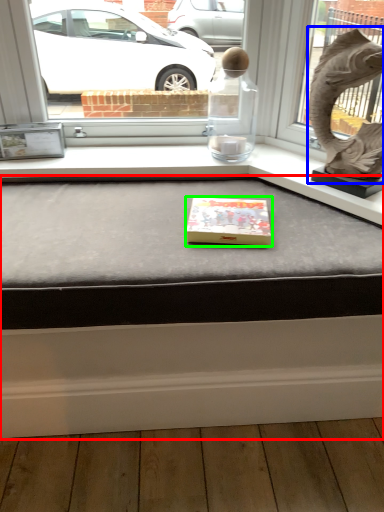
Question: Which object is positioned farthest from table (highlighted by a red box)? Select from animal sculpture (highlighted by a blue box) and box (highlighted by a green box).

Choices:
 (A) animal sculpture
 (B) box

Answer: (A)